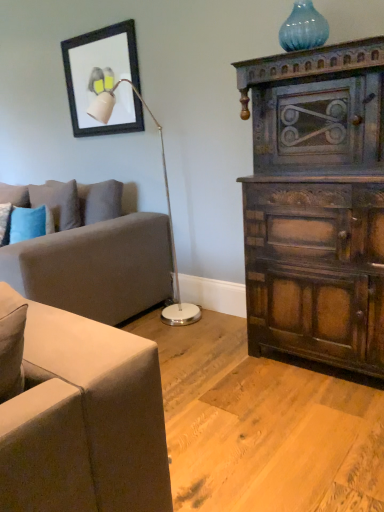
Question: Is blue glass vase at upper right closer to the viewer compared to white glossy floor lamp at upper left?

Choices:
 (A) yes
 (B) no

Answer: (A)

Question: From the image's perspective, does blue glass vase at upper right appear lower than white glossy floor lamp at upper left?

Choices:
 (A) yes
 (B) no

Answer: (B)

Question: Is the position of blue glass vase at upper right more distant than that of white glossy floor lamp at upper left?

Choices:
 (A) yes
 (B) no

Answer: (B)

Question: From a real-world perspective, is blue glass vase at upper right located higher than white glossy floor lamp at upper left?

Choices:
 (A) no
 (B) yes

Answer: (B)

Question: Can you confirm if blue glass vase at upper right is shorter than white glossy floor lamp at upper left?

Choices:
 (A) yes
 (B) no

Answer: (A)

Question: Are blue glass vase at upper right and white glossy floor lamp at upper left located far from each other?

Choices:
 (A) no
 (B) yes

Answer: (B)

Question: Can you confirm if blue textured pillow at left is smaller than blue glass vase at upper right?

Choices:
 (A) yes
 (B) no

Answer: (B)

Question: From a real-world perspective, is blue textured pillow at left on top of blue glass vase at upper right?

Choices:
 (A) yes
 (B) no

Answer: (B)

Question: Is blue glass vase at upper right located within blue textured pillow at left?

Choices:
 (A) yes
 (B) no

Answer: (B)

Question: Can you confirm if blue textured pillow at left is positioned to the left of blue glass vase at upper right?

Choices:
 (A) no
 (B) yes

Answer: (B)

Question: Does blue textured pillow at left have a greater height compared to blue glass vase at upper right?

Choices:
 (A) no
 (B) yes

Answer: (B)

Question: Is the position of blue textured pillow at left more distant than that of blue glass vase at upper right?

Choices:
 (A) no
 (B) yes

Answer: (B)

Question: From the image's perspective, does soft gray fabric couch at left appear lower than dark wood cabinet at right?

Choices:
 (A) yes
 (B) no

Answer: (A)